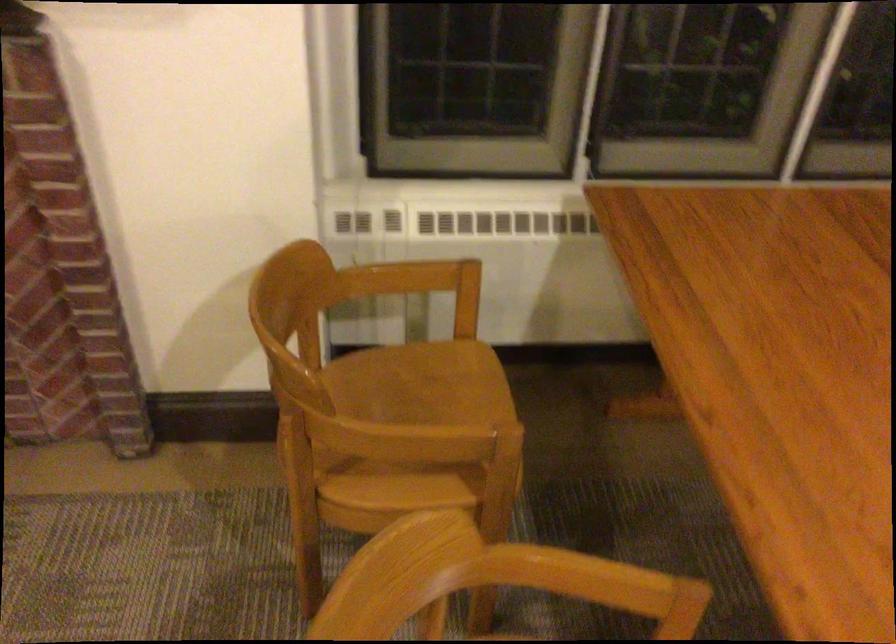
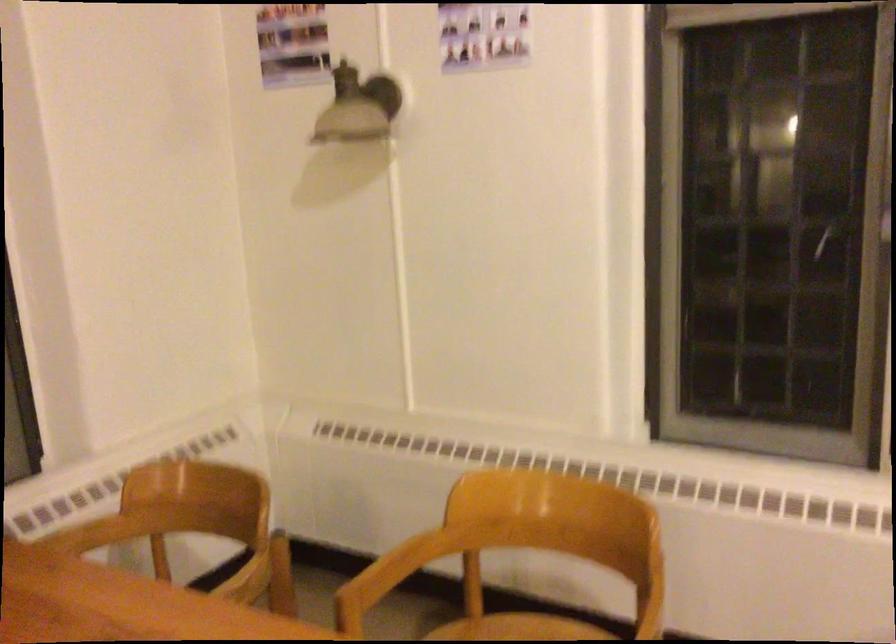
Question: The camera is either moving clockwise (left) or counter-clockwise (right) around the object. The first image is from the beginning of the video and the second image is from the end. Is the camera moving left or right when shooting the video?

Choices:
 (A) Left
 (B) Right

Answer: (A)